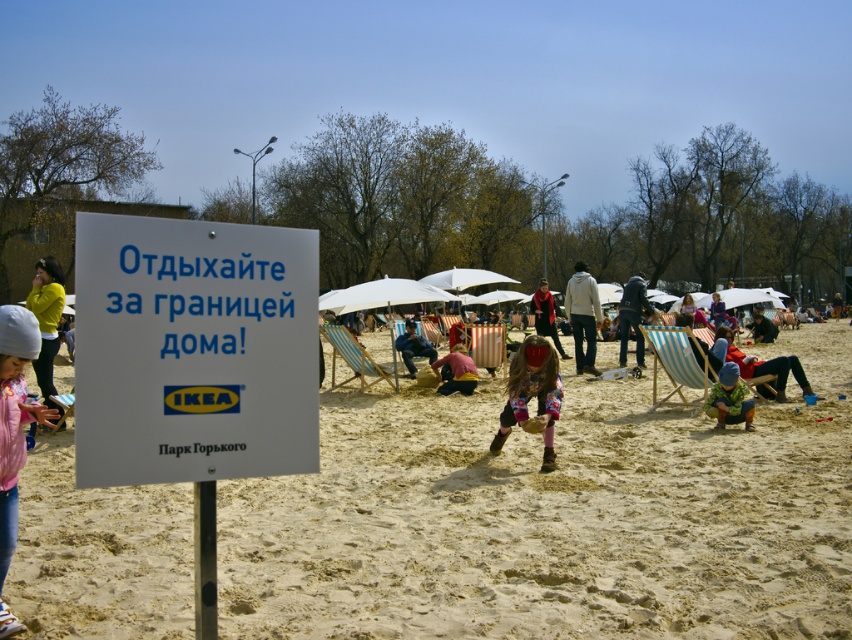
You are a GUI agent. You are given a task and a screenshot of the screen. Output one action in this format:
    pyautogui.click(x=<x>, y=<y>)
    Task: Click on the yellow matte jacket at upper left
    This screenshot has width=852, height=640.
    Given the screenshot: What is the action you would take?
    pyautogui.click(x=45, y=320)

Is yellow matte jacket at upper left shorter than red knitwear at center?

Indeed, yellow matte jacket at upper left has a lesser height compared to red knitwear at center.

Describe the element at coordinates (45, 320) in the screenshot. I see `yellow matte jacket at upper left` at that location.

The height and width of the screenshot is (640, 852). I want to click on yellow matte jacket at upper left, so click(x=45, y=320).

Does light brown sand at center appear over white paper sign at center?

Incorrect, light brown sand at center is not positioned above white paper sign at center.

Which is in front, point (666, 630) or point (222, 294)?

Point (222, 294) is more forward.

Image resolution: width=852 pixels, height=640 pixels. What are the coordinates of `light brown sand at center` in the screenshot? It's located at (553, 518).

Describe the element at coordinates (582, 316) in the screenshot. I see `light gray hoodie at center` at that location.

Between light gray hoodie at center and blue striped chair at center, which one has less height?

Standing shorter between the two is light gray hoodie at center.

Who is more forward, [579,355] or [406,324]?

Positioned in front is point [579,355].

You are a GUI agent. You are given a task and a screenshot of the screen. Output one action in this format:
    pyautogui.click(x=<x>, y=<y>)
    Task: Click on the light gray hoodie at center
    This screenshot has width=852, height=640.
    Given the screenshot: What is the action you would take?
    pyautogui.click(x=582, y=316)